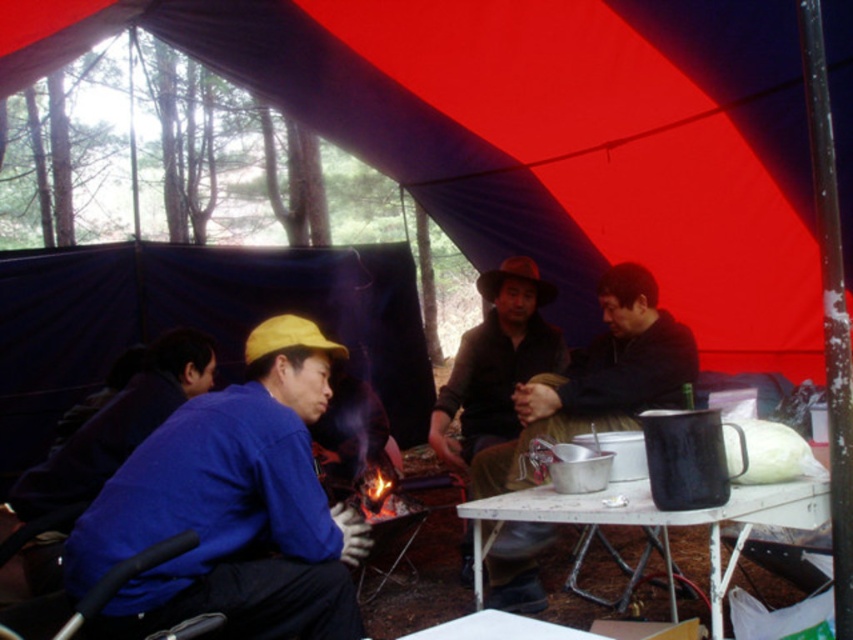
Does matte black jacket at center appear over brown leather hat at center?

No, matte black jacket at center is not above brown leather hat at center.

Can you confirm if matte black jacket at center is positioned to the right of brown leather hat at center?

Indeed, matte black jacket at center is positioned on the right side of brown leather hat at center.

Who is more distant from viewer, (x=659, y=348) or (x=430, y=440)?

Point (x=430, y=440)

Where is `matte black jacket at center`? This screenshot has height=640, width=853. matte black jacket at center is located at coordinates (598, 380).

Which of these two, brown leather hat at center or white plastic table at center, stands shorter?

white plastic table at center is shorter.

This screenshot has width=853, height=640. What do you see at coordinates (496, 362) in the screenshot?
I see `brown leather hat at center` at bounding box center [496, 362].

Who is more distant from viewer, (479,362) or (683,524)?

The point (479,362) is more distant.

At what (x,y) coordinates should I click in order to perform the action: click on brown leather hat at center. Please return your answer as a coordinate pair (x, y). The height and width of the screenshot is (640, 853). Looking at the image, I should click on (496, 362).

Which is below, matte black jacket at center or white plastic table at center?

white plastic table at center

Does matte black jacket at center appear on the right side of white plastic table at center?

Indeed, matte black jacket at center is positioned on the right side of white plastic table at center.

At what (x,y) coordinates should I click in order to perform the action: click on matte black jacket at center. Please return your answer as a coordinate pair (x, y). Looking at the image, I should click on (598, 380).